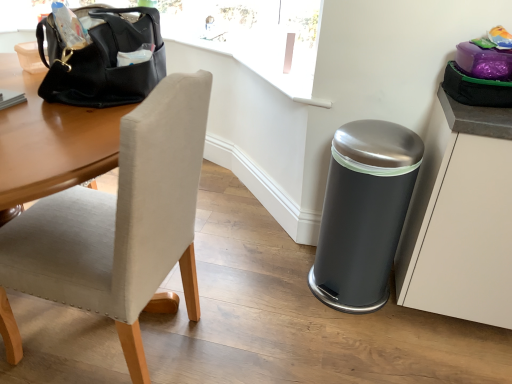
What are the coordinates of `free space to the left of satin silver trash can at lower right` in the screenshot? It's located at (279, 272).